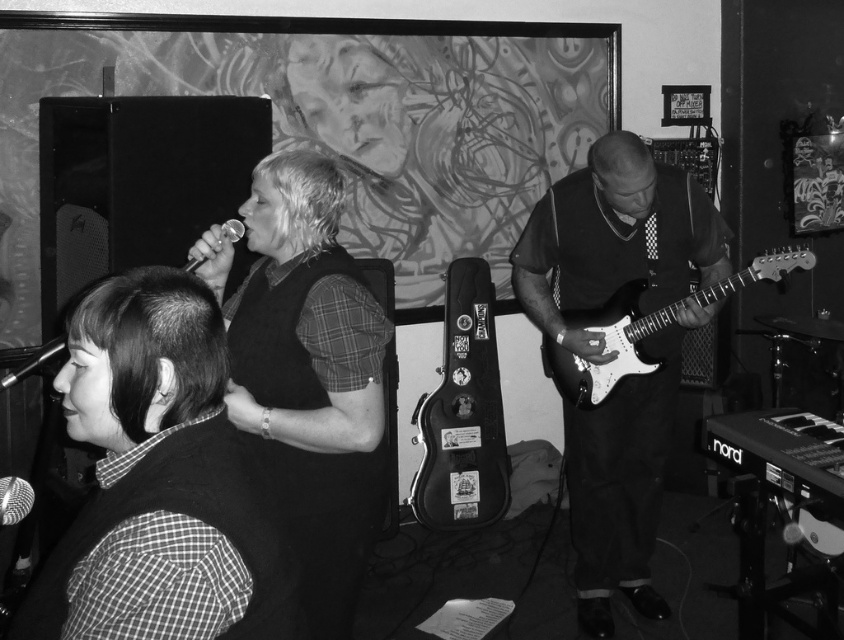
Question: Can you confirm if matte black vest at upper center is bigger than checkered fabric shirt at left?

Choices:
 (A) no
 (B) yes

Answer: (B)

Question: Is black leather guitar case at center behind white glossy electric guitar at right?

Choices:
 (A) yes
 (B) no

Answer: (A)

Question: Which point is farther from the camera taking this photo?

Choices:
 (A) (327, 320)
 (B) (285, 595)
 (C) (617, 394)
 (D) (641, 314)

Answer: (C)

Question: Among these objects, which one is farthest from the camera?

Choices:
 (A) matte black guitar at center
 (B) white glossy electric guitar at right
 (C) black leather guitar case at center
 (D) checkered fabric shirt at left

Answer: (C)

Question: Does matte black vest at upper center have a smaller size compared to matte black guitar at center?

Choices:
 (A) no
 (B) yes

Answer: (B)

Question: Which of these objects is positioned farthest from the black leather guitar case at center?

Choices:
 (A) white glossy electric guitar at right
 (B) checkered fabric shirt at left

Answer: (B)